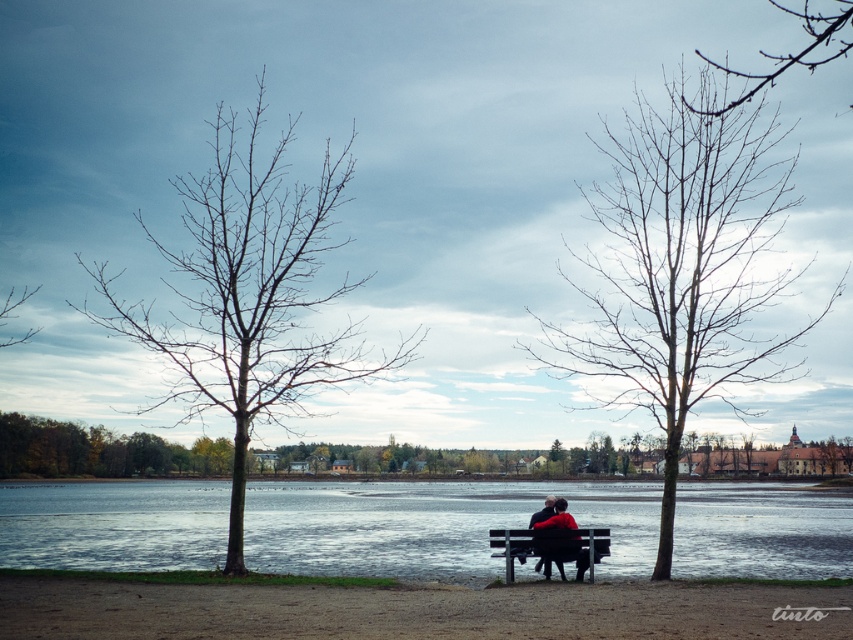
You are standing at the lakeside and notice the smooth water at center and the bare branches at center. Which one is positioned to the right side of the other?

The smooth water at center is to the right of the bare branches at center.

You are an artist trying to paint the scene. You want to place the smooth water at center in your painting. Where should you paint it in relation to the bare branches at center?

You should paint the smooth water at center below the bare branches at center because the smooth water at center is positioned under bare branches at center.